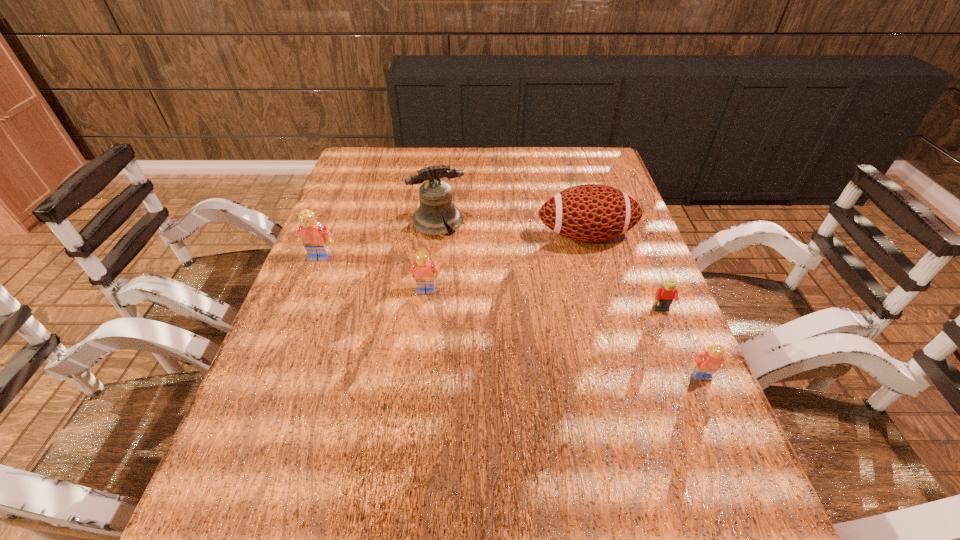
The height and width of the screenshot is (540, 960). I want to click on free point at the near left corner, so click(298, 430).

In the image, there is a desktop. Where is `free region at the far right corner`? The height and width of the screenshot is (540, 960). free region at the far right corner is located at coordinates (600, 147).

Image resolution: width=960 pixels, height=540 pixels. I want to click on vacant space at the near right corner of the desktop, so click(x=712, y=450).

Image resolution: width=960 pixels, height=540 pixels. I want to click on free spot between the third nearest object and the football, so click(x=506, y=263).

Where is `free spot between the tallest object and the nearest Lego`? free spot between the tallest object and the nearest Lego is located at coordinates (570, 300).

I want to click on vacant space in between the second nearest object and the nearest Lego, so click(682, 343).

This screenshot has height=540, width=960. In order to click on vacant space in between the leftmost Lego and the football in this screenshot , I will do `click(453, 247)`.

I want to click on vacant space that's between the football and the bell, so click(x=512, y=230).

Identify the location of vacant point located between the tallest object and the football. (512, 230).

Locate an element on the screen. free space between the farthest Lego and the third farthest Lego is located at coordinates (491, 284).